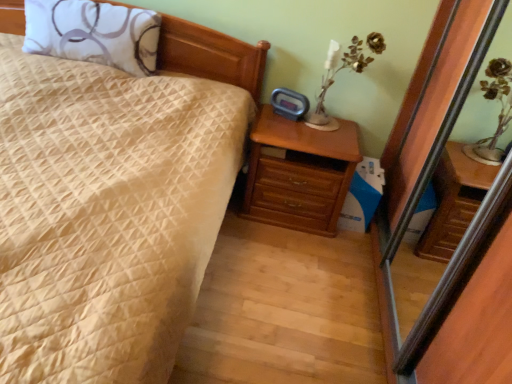
The image size is (512, 384). Identify the location of vacant space situated above wooden chest of drawers at right (from a real-world perspective). (326, 125).